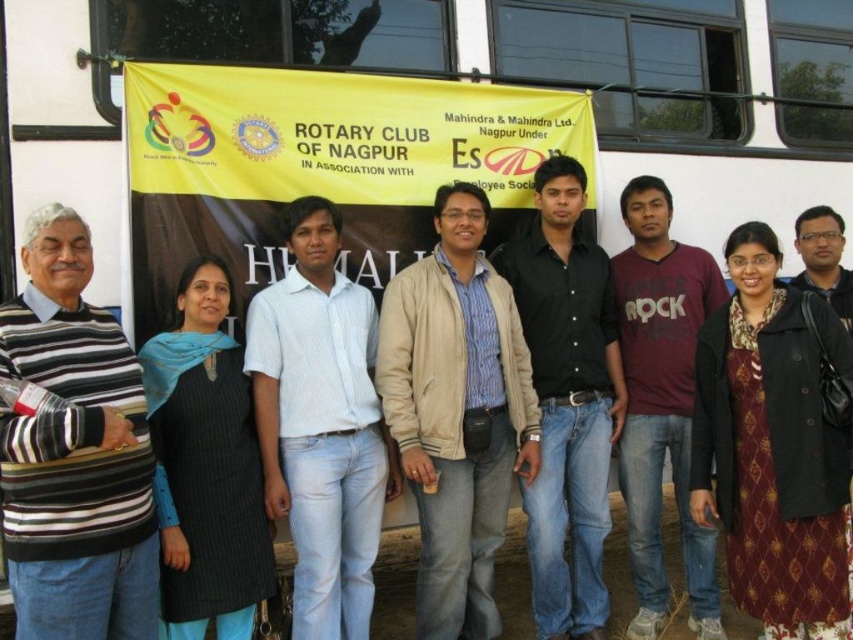
You are a photographer trying to capture a clear photo of the black smooth shirt at center and the black textured dress at center. Which one should you focus on if you want to ensure the larger object is in sharp focus?

The black smooth shirt at center is bigger than the black textured dress at center, so you should focus on the black smooth shirt at center to ensure the larger object is in sharp focus.